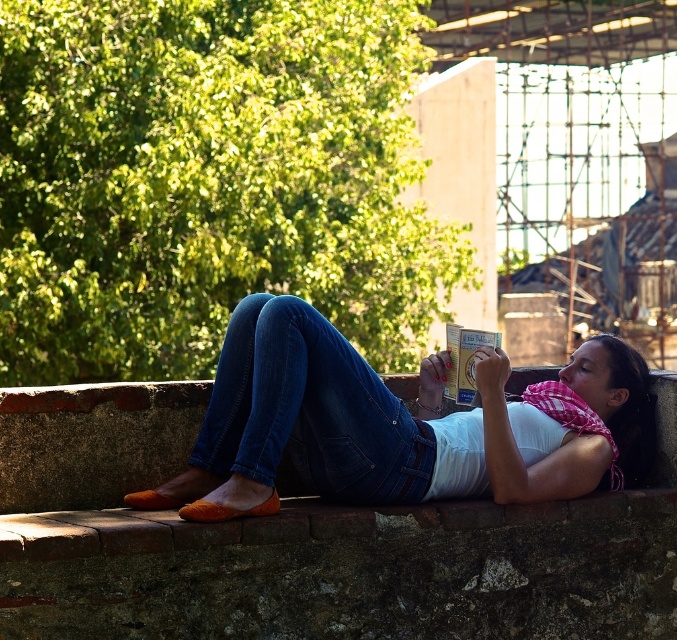
Is white cotton shirt at center to the left of denim at center from the viewer's perspective?

No, white cotton shirt at center is not to the left of denim at center.

Is point (544, 381) positioned in front of point (230, 436)?

No, (544, 381) is behind (230, 436).

Does point (485, 440) come behind point (324, 346)?

Yes, point (485, 440) is farther from viewer.

Locate an element on the screen. The image size is (677, 640). white cotton shirt at center is located at coordinates (399, 422).